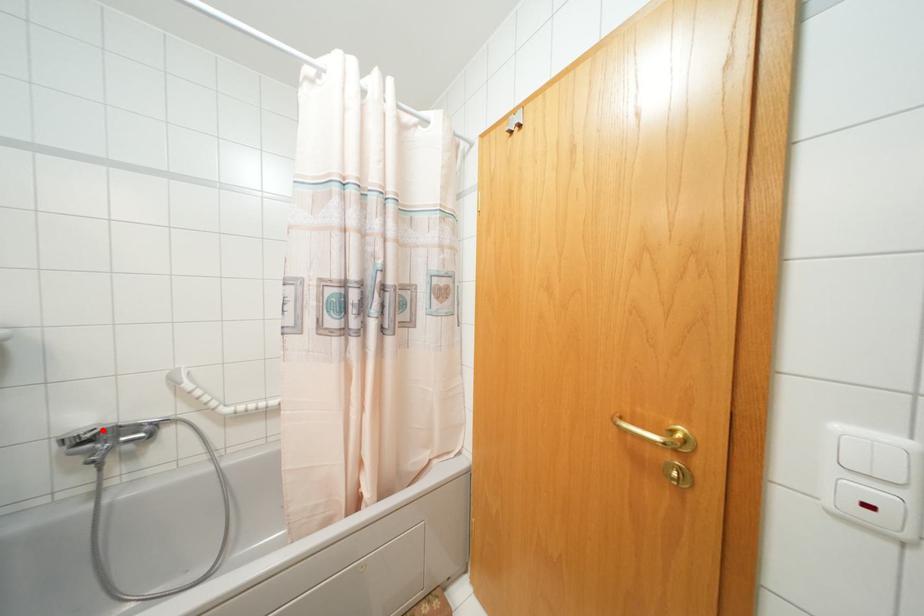
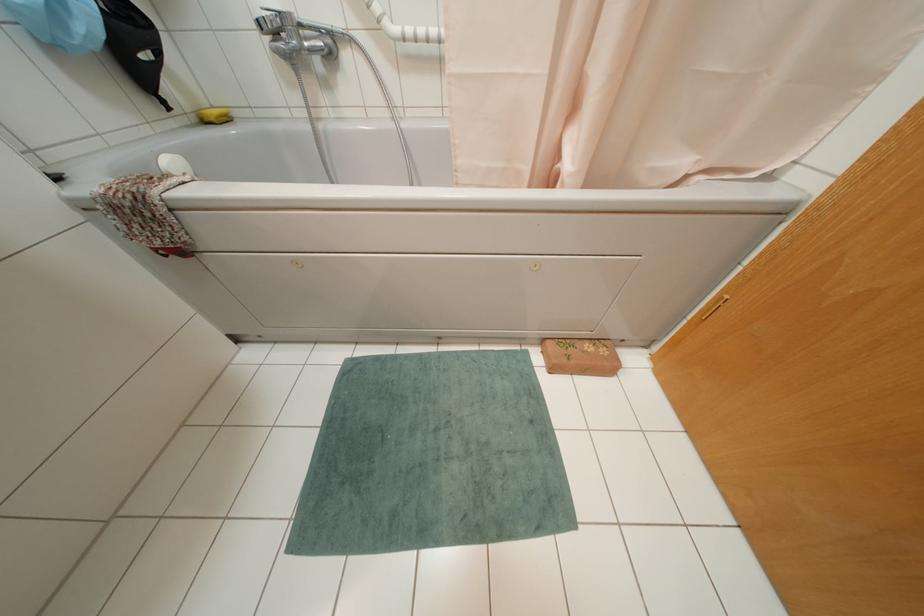
Where in the second image is the point corresponding to the highlighted location from the first image?

(278, 12)